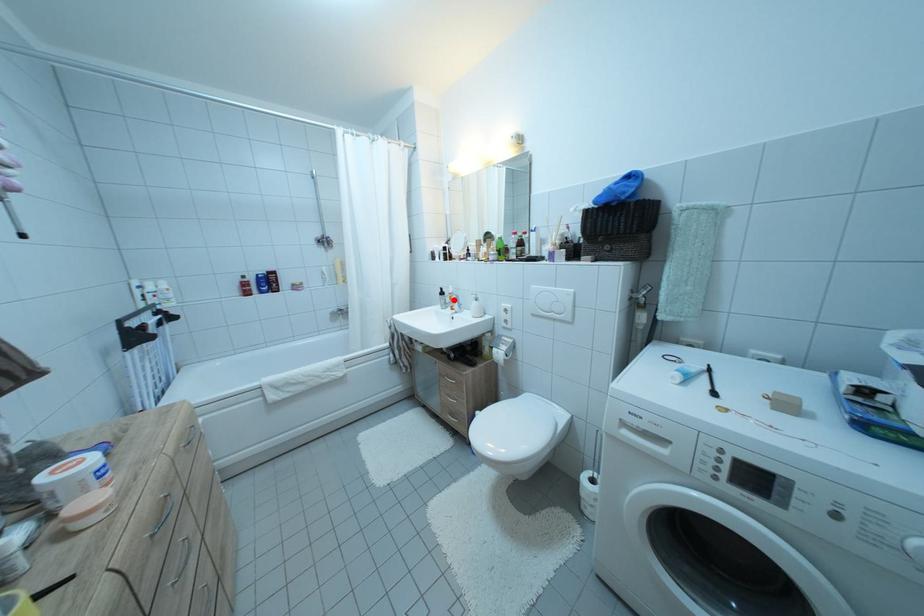
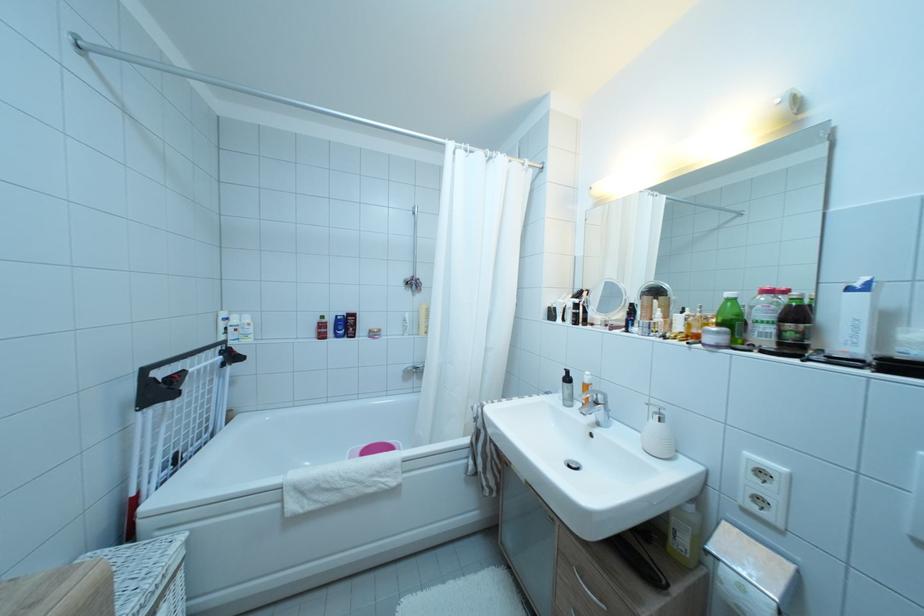
Where in the second image is the point corresponding to the highlighted location from the first image?

(585, 390)